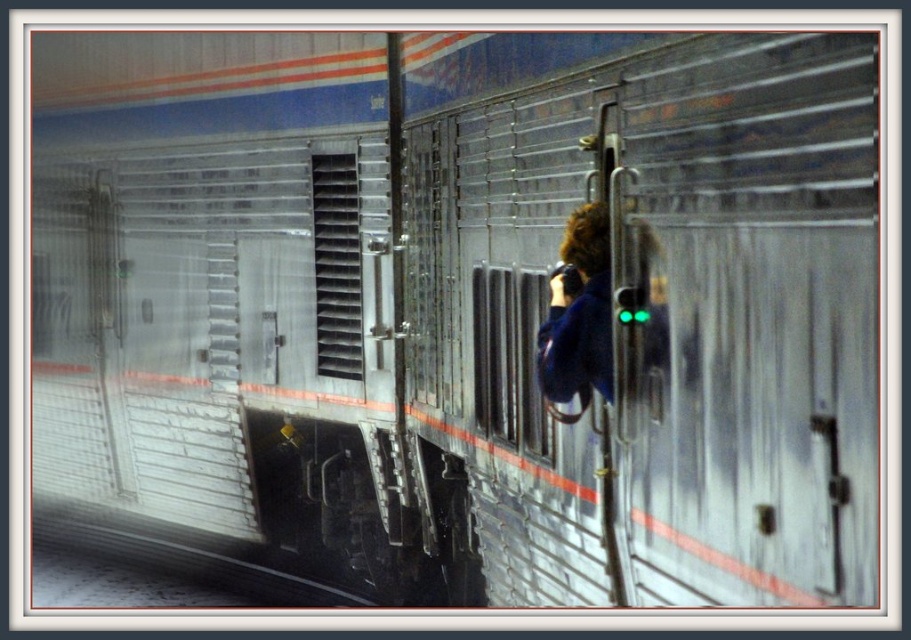
You are standing at the train station and see two points marked on the train. The first point is at coordinates point (x=234, y=554) and the second is at point (x=602, y=205). Which point is closer to you?

Point (x=234, y=554) is closer to you because it is further to the viewer than point (x=602, y=205).

In the scene shown: You are standing at the train station and see the gray concrete train track at lower left and the blue fabric jacket at center. Which object is taller?

The blue fabric jacket at center is taller than the gray concrete train track at lower left.

You are standing at the train station and see the gray concrete train track at lower left and the blue fabric jacket at center. Which object is positioned lower in the image?

The gray concrete train track at lower left is positioned below the blue fabric jacket at center, so it is lower in the image.